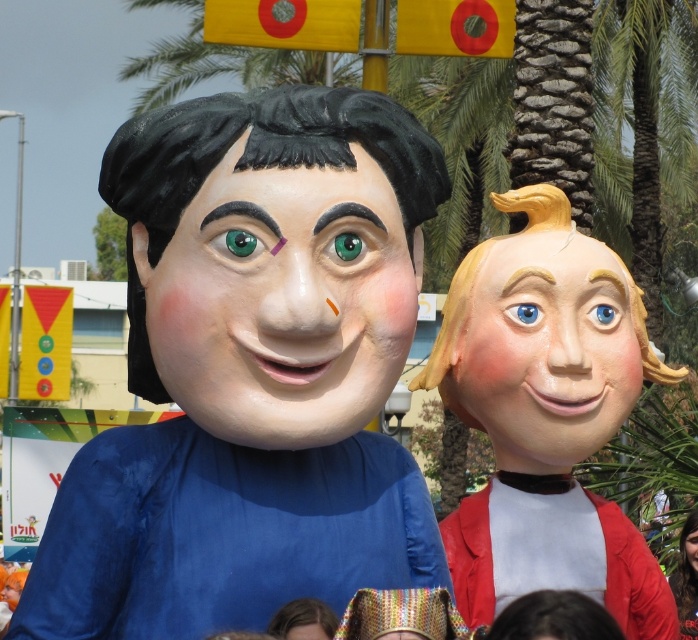
Question: Which point appears farthest from the camera in this image?

Choices:
 (A) (163, 595)
 (B) (251, 316)

Answer: (A)

Question: Which object appears closest to the camera in this image?

Choices:
 (A) smooth beige face at right
 (B) matte blue costume at center
 (C) matte plastic face at center
 (D) smooth skin face at center

Answer: (C)

Question: Does smooth yellow hair at right lie in front of smooth skin face at center?

Choices:
 (A) yes
 (B) no

Answer: (A)

Question: Is matte plastic face at center further to the viewer compared to smooth skin face at center?

Choices:
 (A) no
 (B) yes

Answer: (A)

Question: Which point is farther from the camera taking this photo?

Choices:
 (A) (265, 100)
 (B) (193, 212)

Answer: (A)

Question: Does smooth yellow hair at right appear on the left side of smooth skin face at center?

Choices:
 (A) no
 (B) yes

Answer: (B)